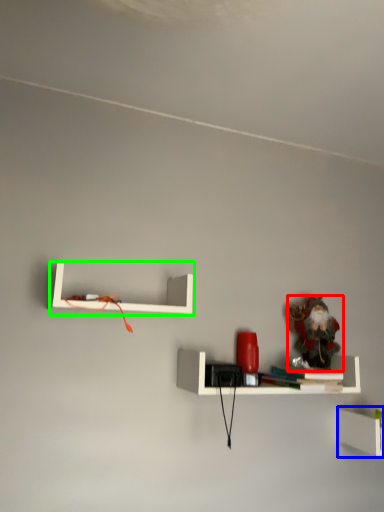
Question: Considering the real-world distances, which object is closest to toy (highlighted by a red box)? shelf (highlighted by a blue box) or shelf (highlighted by a green box).

Choices:
 (A) shelf
 (B) shelf

Answer: (A)